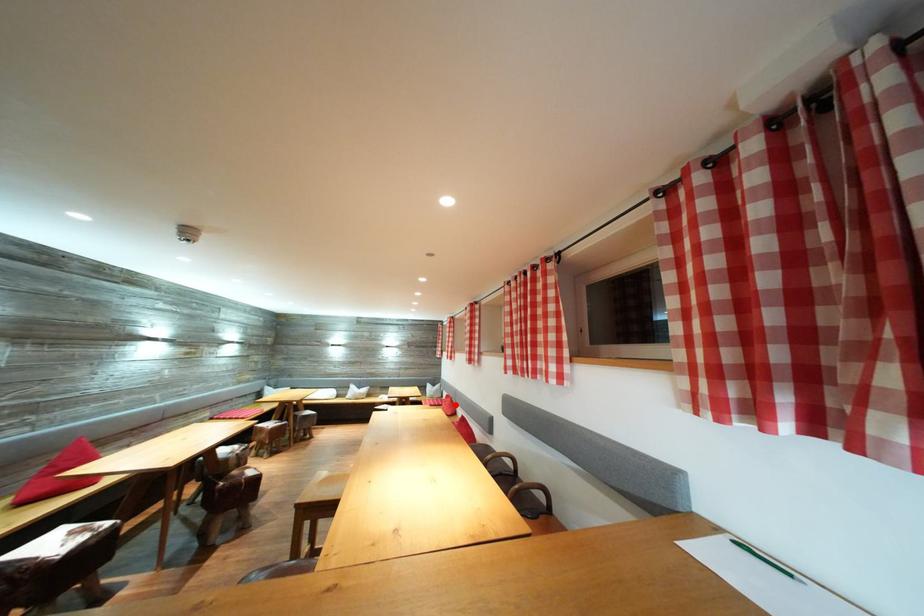
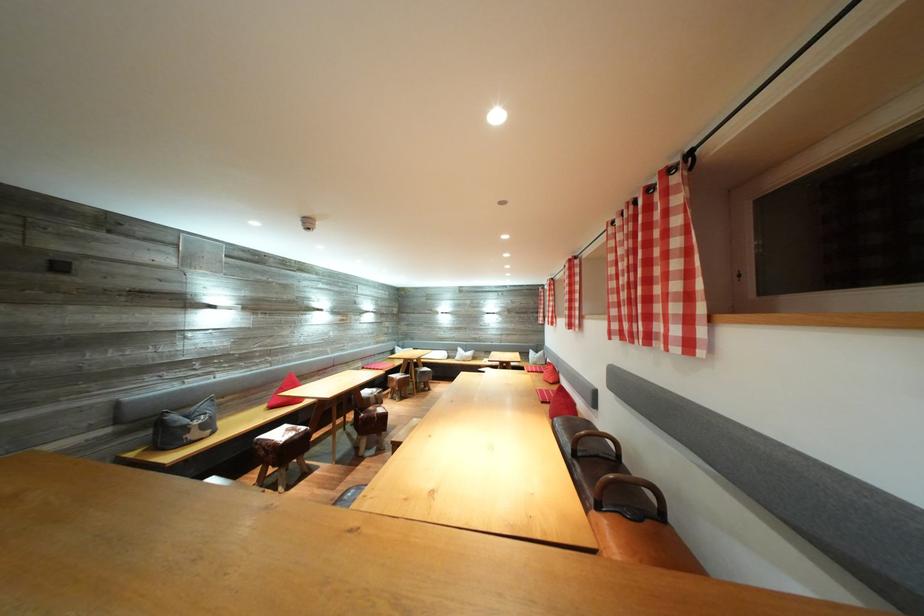
Question: I am providing you with two images of the same scene from different viewpoints. Given a red point in image1, look at the same physical point in image2. Is it:

Choices:
 (A) Closer to the viewpoint
 (B) Farther from the viewpoint

Answer: (A)